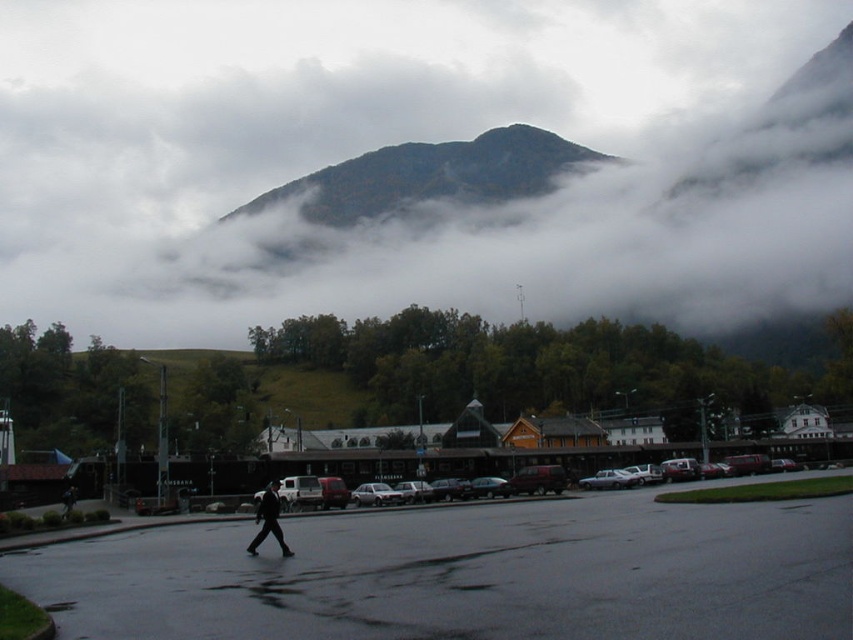
Between white fluffy cloud at upper center and black matte suit at center, which one is positioned lower?

Positioned lower is black matte suit at center.

Is point (357, 80) farther from camera compared to point (277, 529)?

Yes, point (357, 80) is behind point (277, 529).

Identify the location of white fluffy cloud at upper center. The width and height of the screenshot is (853, 640). (392, 141).

Is green forested mountain at upper center further to camera compared to matte black car at center?

Yes.

Who is higher up, green forested mountain at upper center or matte black car at center?

green forested mountain at upper center

Is point (425, 177) behind point (273, 470)?

Yes, it is behind point (273, 470).

Identify the location of green forested mountain at upper center. (x=431, y=176).

Between green forested mountain at upper center and black matte suit at center, which one appears on the right side from the viewer's perspective?

Positioned to the right is black matte suit at center.

Does green forested mountain at upper center appear over black matte suit at center?

Indeed, green forested mountain at upper center is positioned over black matte suit at center.

This screenshot has width=853, height=640. I want to click on green forested mountain at upper center, so click(x=431, y=176).

Find the location of a particular element. The height and width of the screenshot is (640, 853). green forested mountain at upper center is located at coordinates (431, 176).